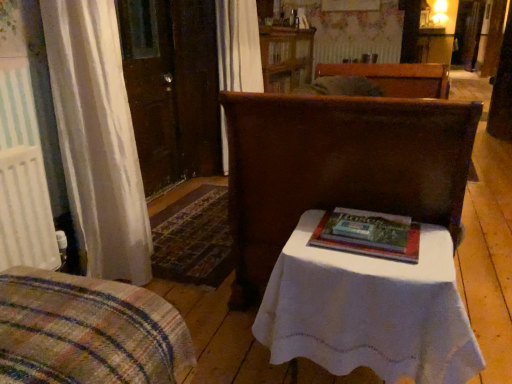
Question: Does matte brown chair at center, which is the 1th furniture from back to front, have a greater width compared to wooden cabinet at upper center?

Choices:
 (A) no
 (B) yes

Answer: (B)

Question: Is wooden cabinet at upper center surrounded by matte brown chair at center, the 1th furniture in the right-to-left sequence?

Choices:
 (A) yes
 (B) no

Answer: (B)

Question: Is matte brown chair at center, the second furniture viewed from the front, oriented towards wooden cabinet at upper center?

Choices:
 (A) yes
 (B) no

Answer: (B)

Question: Are matte brown chair at center, the 1th furniture in the right-to-left sequence, and wooden cabinet at upper center far apart?

Choices:
 (A) yes
 (B) no

Answer: (A)

Question: Is matte brown chair at center, which is the 1th furniture from back to front, behind wooden cabinet at upper center?

Choices:
 (A) no
 (B) yes

Answer: (A)

Question: Is matte brown chair at center, the 2th furniture viewed from the left, closer to the viewer compared to wooden cabinet at upper center?

Choices:
 (A) no
 (B) yes

Answer: (B)

Question: From a real-world perspective, is matte brown chair at center, the second furniture viewed from the front, located higher than white cloth-covered table at center?

Choices:
 (A) no
 (B) yes

Answer: (B)

Question: Is matte brown chair at center, which is the 1th furniture from back to front, at the right side of white cloth-covered table at center?

Choices:
 (A) no
 (B) yes

Answer: (B)

Question: Does matte brown chair at center, the 1th furniture in the right-to-left sequence, have a lesser height compared to white cloth-covered table at center?

Choices:
 (A) yes
 (B) no

Answer: (B)

Question: Considering the relative sizes of matte brown chair at center, the second furniture viewed from the front, and white cloth-covered table at center in the image provided, is matte brown chair at center, the second furniture viewed from the front, taller than white cloth-covered table at center?

Choices:
 (A) no
 (B) yes

Answer: (B)

Question: Can you confirm if matte brown chair at center, the 1th furniture in the right-to-left sequence, is smaller than white cloth-covered table at center?

Choices:
 (A) no
 (B) yes

Answer: (A)

Question: Does matte brown chair at center, the 2th furniture viewed from the left, have a lesser width compared to white cloth-covered table at center?

Choices:
 (A) yes
 (B) no

Answer: (B)

Question: Is plaid fabric bedspread at lower left, marked as the 2th furniture in a right-to-left arrangement, taller than matte brown chair at center, the 2th furniture viewed from the left?

Choices:
 (A) yes
 (B) no

Answer: (B)